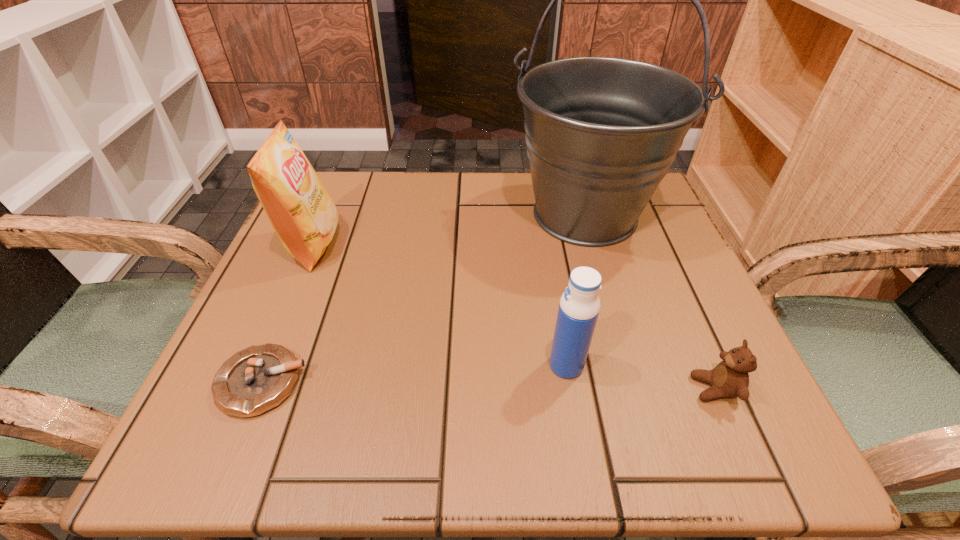
This screenshot has width=960, height=540. Identify the location of the tallest object. (601, 133).

At what (x,y) coordinates should I click in order to perform the action: click on crisp (potato chip). Please return your answer as a coordinate pair (x, y). Looking at the image, I should click on (299, 208).

Where is `water bottle`? The height and width of the screenshot is (540, 960). water bottle is located at coordinates (579, 306).

The width and height of the screenshot is (960, 540). What are the coordinates of `the fourth tallest object` in the screenshot? It's located at (729, 379).

Locate an element on the screen. the shortest object is located at coordinates click(257, 379).

Where is `free spot located 0.130m on the front of the bucket`? This screenshot has height=540, width=960. free spot located 0.130m on the front of the bucket is located at coordinates (614, 318).

I want to click on free region located 0.060m on the front-facing side of the crisp (potato chip), so click(x=369, y=245).

Find the location of a particular element. The width and height of the screenshot is (960, 540). vacant space situated on the left of the third tallest object is located at coordinates (301, 365).

You are a GUI agent. You are given a task and a screenshot of the screen. Output one action in this format:
    pyautogui.click(x=<x>, y=<y>)
    Task: Click on the vacant space located 0.340m at the face of the teddy bear
    Image resolution: width=960 pixels, height=540 pixels.
    Given the screenshot: What is the action you would take?
    pyautogui.click(x=456, y=388)

The height and width of the screenshot is (540, 960). Find the location of `free spot located at the face of the teddy bear`. free spot located at the face of the teddy bear is located at coordinates (623, 388).